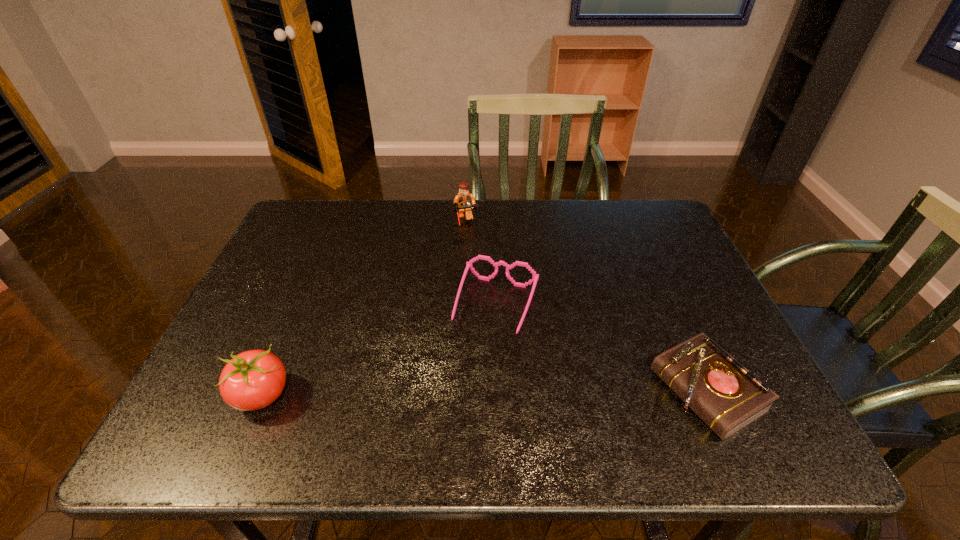
Where is `vacant region located on the arms of the spectacles`? This screenshot has height=540, width=960. vacant region located on the arms of the spectacles is located at coordinates (464, 400).

At what (x,y) coordinates should I click in order to perform the action: click on free space located 0.070m on the arms of the spectacles. Please return your answer as a coordinate pair (x, y). Image resolution: width=960 pixels, height=540 pixels. Looking at the image, I should click on (477, 362).

Find the location of a particular element. vacant area located on the arms of the spectacles is located at coordinates (463, 404).

You are a GUI agent. You are given a task and a screenshot of the screen. Output one action in this format:
    pyautogui.click(x=<x>, y=<y>)
    Task: Click on the object at the far edge
    
    Given the screenshot: What is the action you would take?
    pyautogui.click(x=464, y=202)

Where is `tomato located in the near edge section of the desktop`? This screenshot has height=540, width=960. tomato located in the near edge section of the desktop is located at coordinates (252, 380).

The width and height of the screenshot is (960, 540). What are the coordinates of `diary situated at the near edge` in the screenshot? It's located at (722, 392).

The width and height of the screenshot is (960, 540). I want to click on object at the left edge, so click(252, 380).

Locate an element on the screen. This screenshot has width=960, height=540. object that is at the right edge is located at coordinates (722, 392).

The height and width of the screenshot is (540, 960). I want to click on object positioned at the near left corner, so click(x=252, y=380).

At what (x,y) coordinates should I click in order to perform the action: click on object at the near right corner. Please return your answer as a coordinate pair (x, y). This screenshot has height=540, width=960. Looking at the image, I should click on (722, 392).